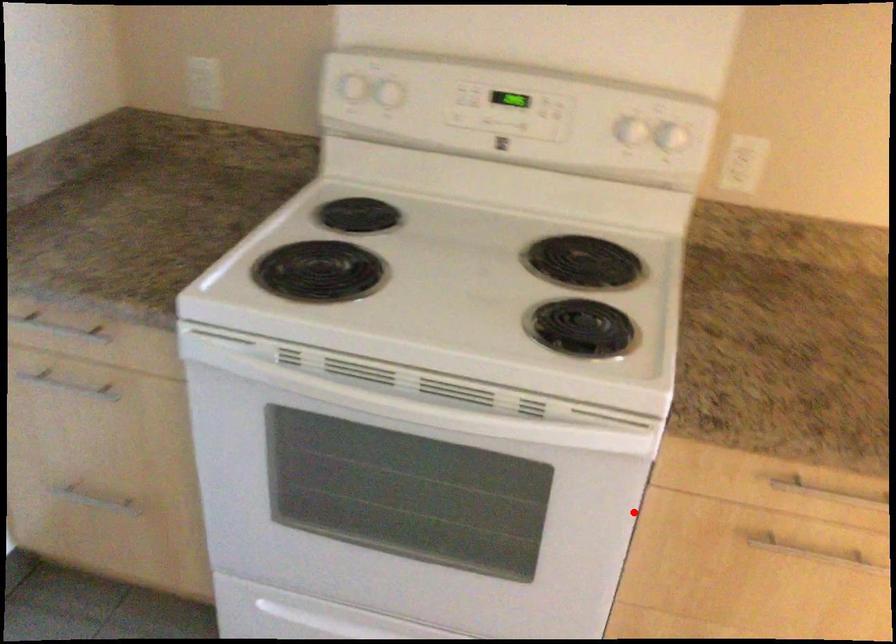
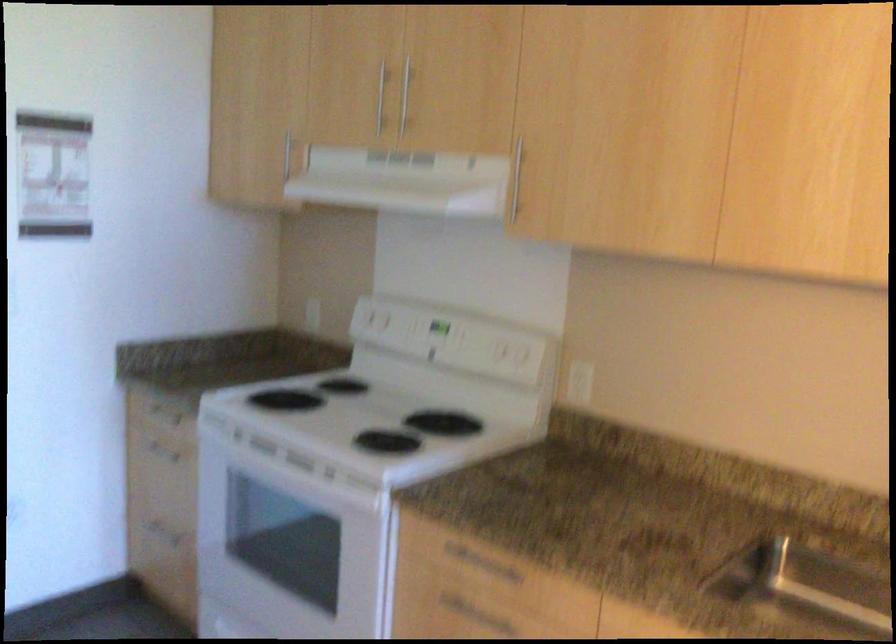
Question: I am providing you with two images of the same scene from different viewpoints. Image1 has a red point marked. In image2, the corresponding 3D location appears at what relative position? Reply with the corresponding letter.

Choices:
 (A) Closer
 (B) Farther

Answer: (B)